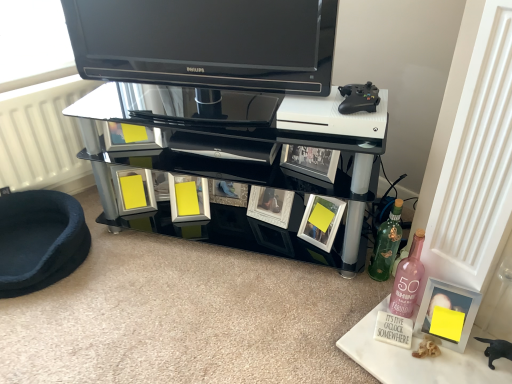
You are a GUI agent. You are given a task and a screenshot of the screen. Output one action in this format:
    pyautogui.click(x=<x>, y=<y>)
    Task: Click on the vacant space in between black glass shelf at center and pink glass bottle at lower right, which appears as the first bottle when viewed from the front
    Image resolution: width=512 pixels, height=384 pixels.
    Given the screenshot: What is the action you would take?
    pyautogui.click(x=285, y=275)